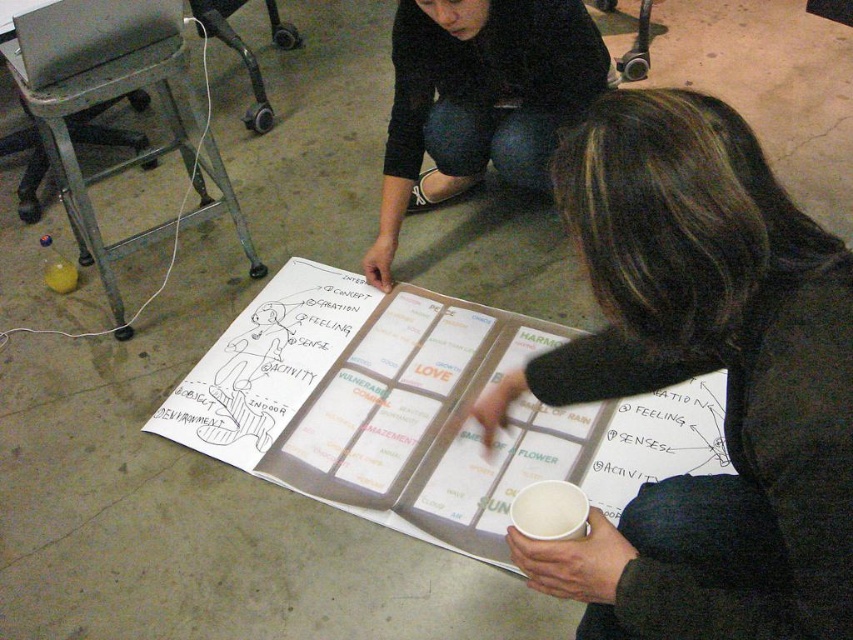
Can you confirm if black fabric at lower right is shorter than black fabric at center?

No.

Does point (639, 362) lie in front of point (421, 76)?

Yes, it is.

I want to click on black fabric at lower right, so click(x=703, y=372).

Looking at this image, is black fabric at lower right in front of white paper cup at lower center?

Yes, black fabric at lower right is in front of white paper cup at lower center.

Does black fabric at lower right appear on the left side of white paper cup at lower center?

Incorrect, black fabric at lower right is not on the left side of white paper cup at lower center.

Is point (715, 368) farther from camera compared to point (537, 483)?

No, it is not.

This screenshot has height=640, width=853. What are the coordinates of `black fabric at lower right` in the screenshot? It's located at (703, 372).

Does black fabric at center come in front of white paper cup at lower center?

No, it is behind white paper cup at lower center.

Is black fabric at center below white paper cup at lower center?

Actually, black fabric at center is above white paper cup at lower center.

Where is `black fabric at center`? The image size is (853, 640). black fabric at center is located at coordinates (479, 100).